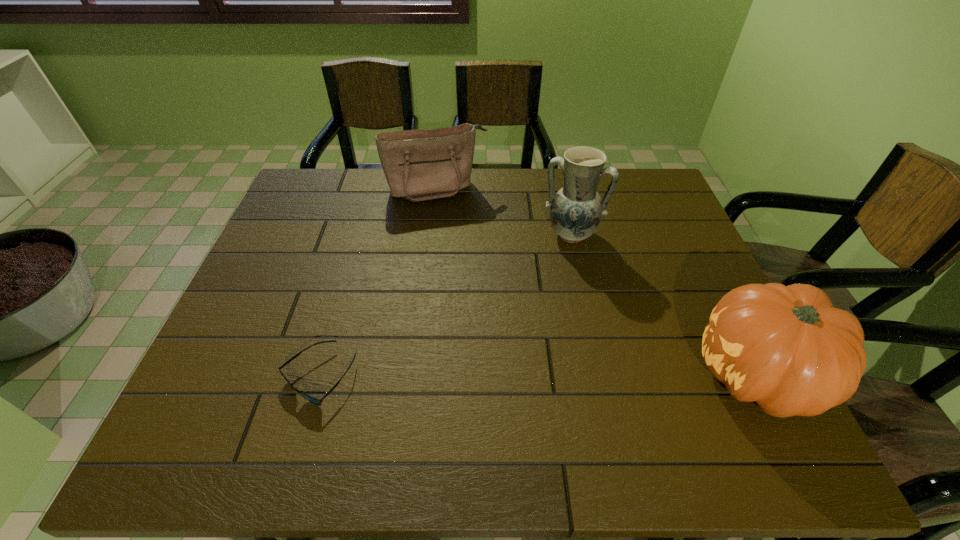
This screenshot has height=540, width=960. I want to click on free space on the desktop that is between the sunglasses and the rightmost object and is positioned on either side of the second farthest object, so [530, 376].

You are a GUI agent. You are given a task and a screenshot of the screen. Output one action in this format:
    pyautogui.click(x=<x>, y=<y>)
    Task: Click on the vacant spot on the desktop that is between the shortest object and the rightmost object and is positioned on the front pocket of the shoulder bag
    This screenshot has width=960, height=540.
    Given the screenshot: What is the action you would take?
    pyautogui.click(x=498, y=376)